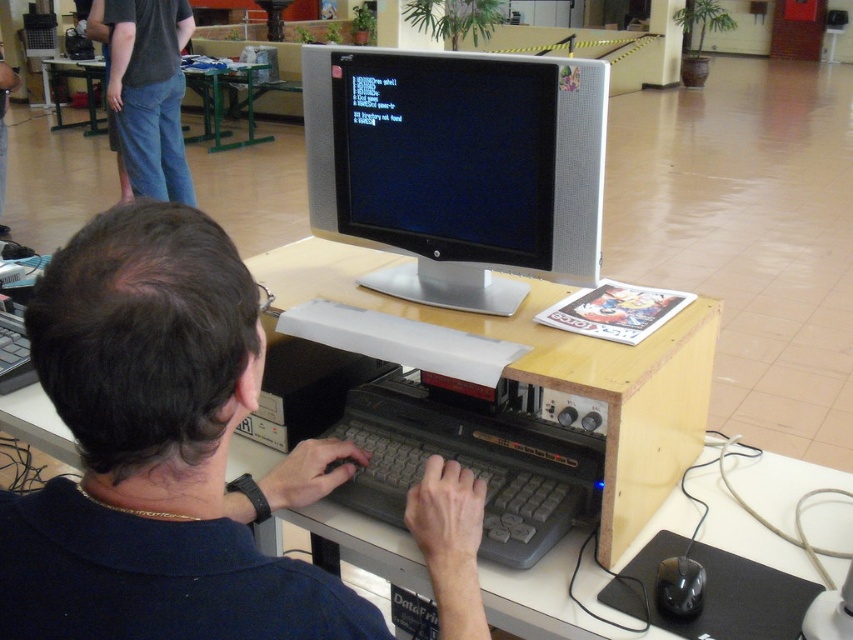
Question: Is jeans at left bigger than black plastic mouse at lower right?

Choices:
 (A) yes
 (B) no

Answer: (A)

Question: Which object appears farthest from the camera in this image?

Choices:
 (A) dark blue shirt at center
 (B) black plastic mouse at lower right

Answer: (B)

Question: Based on their relative distances, which object is nearer to the black plastic mouse at lower right?

Choices:
 (A) dark blue shirt at center
 (B) jeans at left
 (C) green metal table at upper left
 (D) silver metallic monitor at center

Answer: (A)

Question: Which point is farther to the camera?

Choices:
 (A) (692, 586)
 (B) (184, 6)

Answer: (B)

Question: Is silver metallic monitor at center smaller than green metal table at upper left?

Choices:
 (A) no
 (B) yes

Answer: (B)

Question: Does dark blue shirt at center appear on the right side of green metal table at upper left?

Choices:
 (A) yes
 (B) no

Answer: (A)